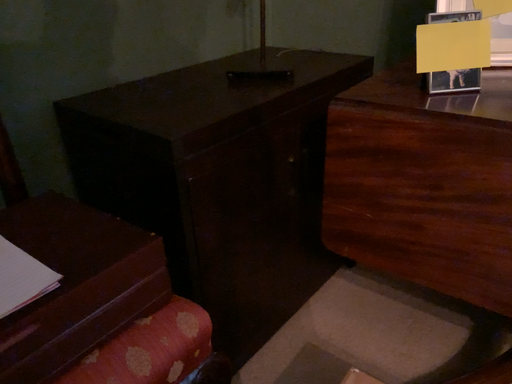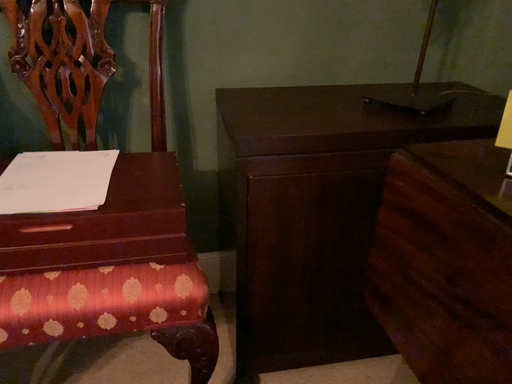
Question: How did the camera likely rotate when shooting the video?

Choices:
 (A) rotated upward
 (B) rotated downward

Answer: (A)